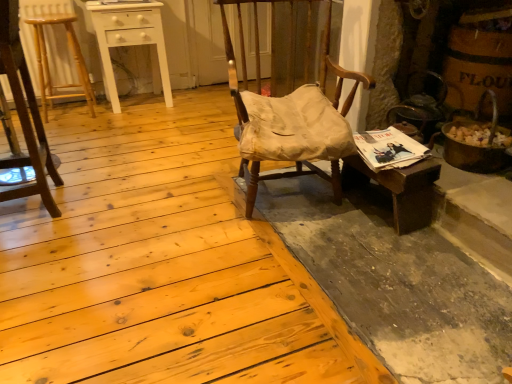
The image size is (512, 384). Find the location of `vacant region below light brown wood bar stool at left (from a real-world perspective)`. vacant region below light brown wood bar stool at left (from a real-world perspective) is located at coordinates (73, 113).